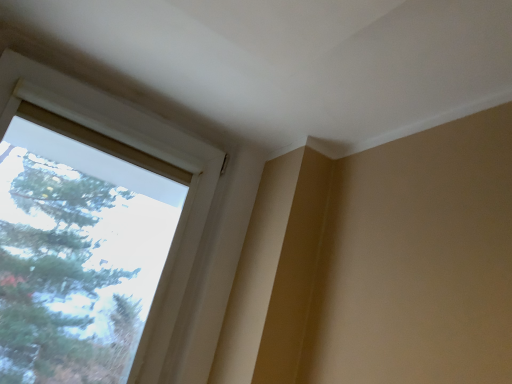
The image size is (512, 384). Describe the element at coordinates (138, 149) in the screenshot. I see `white plastic window at upper left` at that location.

I want to click on white plastic window at upper left, so click(x=138, y=149).

You are a GUI agent. You are given a task and a screenshot of the screen. Output one action in this format:
    pyautogui.click(x=<x>, y=<y>)
    Task: Click on the white plastic window at upper left
    This screenshot has width=512, height=384.
    Given the screenshot: What is the action you would take?
    pyautogui.click(x=138, y=149)